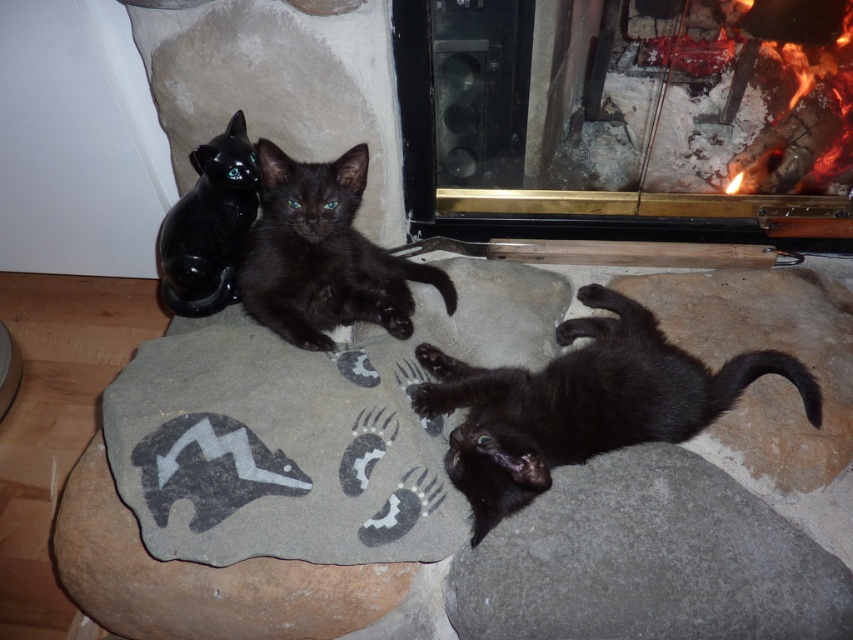
Is charcoal ash fireplace at upper right bigger than black fur cat at lower right?

Correct, charcoal ash fireplace at upper right is larger in size than black fur cat at lower right.

In the scene shown: Between charcoal ash fireplace at upper right and black fur cat at lower right, which one is positioned higher?

Positioned higher is charcoal ash fireplace at upper right.

Describe the element at coordinates (619, 120) in the screenshot. I see `charcoal ash fireplace at upper right` at that location.

Identify the location of charcoal ash fireplace at upper right. This screenshot has width=853, height=640. (619, 120).

Who is higher up, charcoal ash fireplace at upper right or matte black kitten at center?

Positioned higher is charcoal ash fireplace at upper right.

Image resolution: width=853 pixels, height=640 pixels. Find the location of `charcoal ash fireplace at upper right`. charcoal ash fireplace at upper right is located at coordinates (619, 120).

The image size is (853, 640). In order to click on charcoal ash fireplace at upper right in this screenshot , I will do `click(619, 120)`.

Which of these two, black fur cat at lower right or matte black kitten at center, stands shorter?

matte black kitten at center

Which is more to the left, black fur cat at lower right or matte black kitten at center?

matte black kitten at center is more to the left.

Which is behind, point (494, 401) or point (387, 259)?

The point (387, 259) is behind.

I want to click on black fur cat at lower right, so click(582, 403).